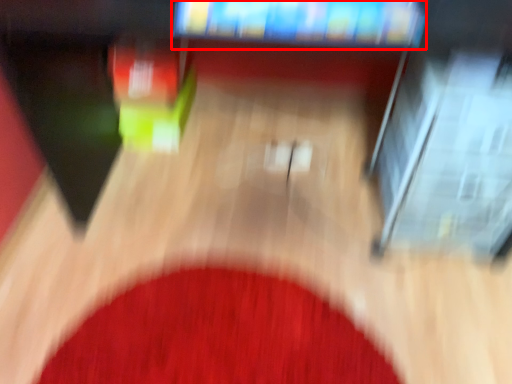
Question: In this image, where is television (annotated by the red box) located relative to mat?

Choices:
 (A) right
 (B) left

Answer: (A)